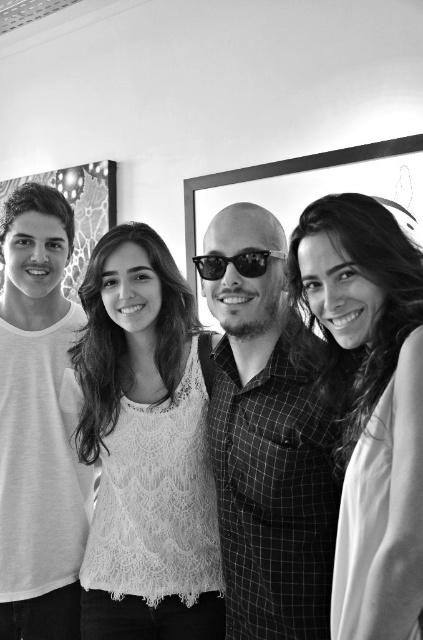
Question: Can you confirm if grid-patterned shirt at center is positioned below white lace top at center?

Choices:
 (A) yes
 (B) no

Answer: (A)

Question: Estimate the real-world distances between objects in this image. Which object is farther from the black reflective sunglasses at center?

Choices:
 (A) grid-patterned shirt at center
 (B) white lace top at center

Answer: (B)

Question: Can you confirm if lace fabric top at center is positioned above white lace top at center?

Choices:
 (A) no
 (B) yes

Answer: (A)

Question: Which object appears closest to the camera in this image?

Choices:
 (A) lace fabric top at center
 (B) grid-patterned shirt at center

Answer: (B)

Question: Can you confirm if lace fabric top at center is thinner than white lace top at center?

Choices:
 (A) yes
 (B) no

Answer: (B)

Question: Based on their relative distances, which object is nearer to the white lace top at center?

Choices:
 (A) black reflective sunglasses at center
 (B) lace fabric top at center

Answer: (A)